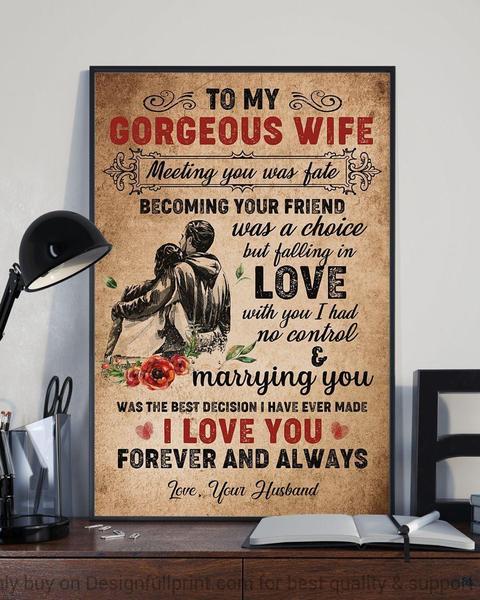
At what (x,y) coordinates should I click in order to perform the action: click on books. Please return your answer as a coordinate pair (x, y). Looking at the image, I should click on (473, 500), (474, 510), (474, 524), (383, 529).